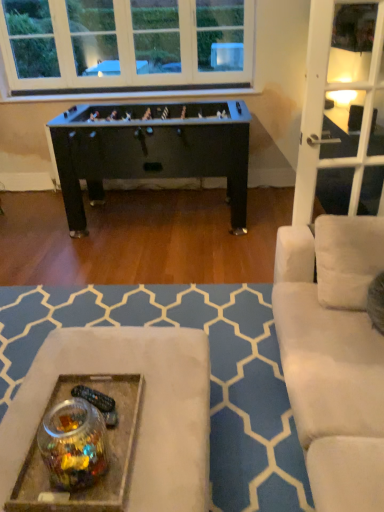
Question: Is translucent glass jar at lower left facing towards metallic tray at lower center?

Choices:
 (A) no
 (B) yes

Answer: (A)

Question: Is translucent glass jar at lower left positioned with its back to metallic tray at lower center?

Choices:
 (A) no
 (B) yes

Answer: (A)

Question: Is translucent glass jar at lower left closer to the viewer compared to metallic tray at lower center?

Choices:
 (A) no
 (B) yes

Answer: (B)

Question: Are translucent glass jar at lower left and metallic tray at lower center far apart?

Choices:
 (A) no
 (B) yes

Answer: (A)

Question: From a real-world perspective, is translucent glass jar at lower left over metallic tray at lower center?

Choices:
 (A) yes
 (B) no

Answer: (A)

Question: Is translucent glass jar at lower left outside metallic tray at lower center?

Choices:
 (A) no
 (B) yes

Answer: (B)

Question: From a real-world perspective, is metallic tray at lower center physically below translucent glass jar at lower left?

Choices:
 (A) no
 (B) yes

Answer: (B)

Question: Does metallic tray at lower center have a greater width compared to translucent glass jar at lower left?

Choices:
 (A) no
 (B) yes

Answer: (B)

Question: Is metallic tray at lower center directly adjacent to translucent glass jar at lower left?

Choices:
 (A) yes
 (B) no

Answer: (B)

Question: From a real-world perspective, is metallic tray at lower center located higher than translucent glass jar at lower left?

Choices:
 (A) no
 (B) yes

Answer: (A)

Question: Is metallic tray at lower center shorter than translucent glass jar at lower left?

Choices:
 (A) yes
 (B) no

Answer: (A)

Question: Is metallic tray at lower center positioned before translucent glass jar at lower left?

Choices:
 (A) yes
 (B) no

Answer: (B)

Question: Is point (183, 450) closer or farther from the camera than point (74, 396)?

Choices:
 (A) farther
 (B) closer

Answer: (B)